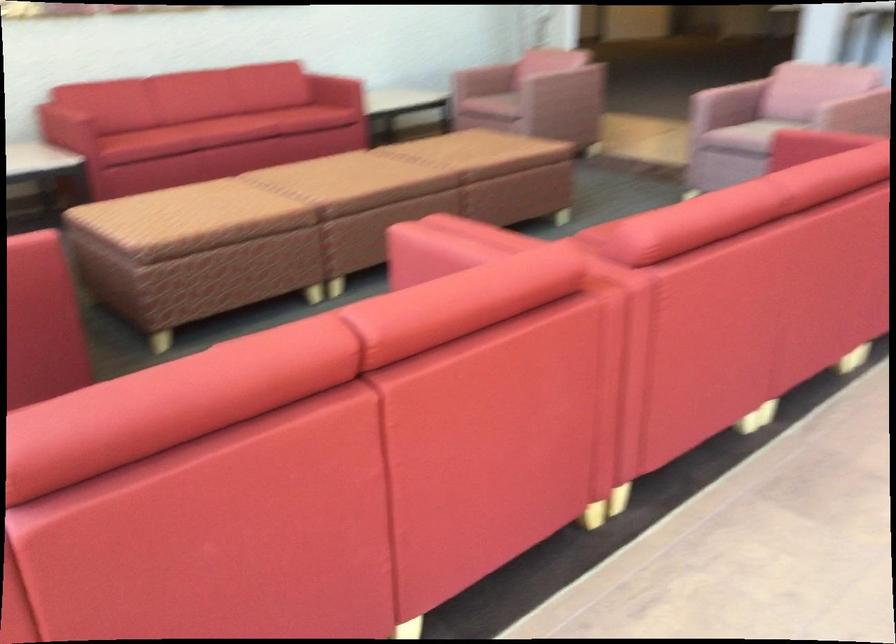
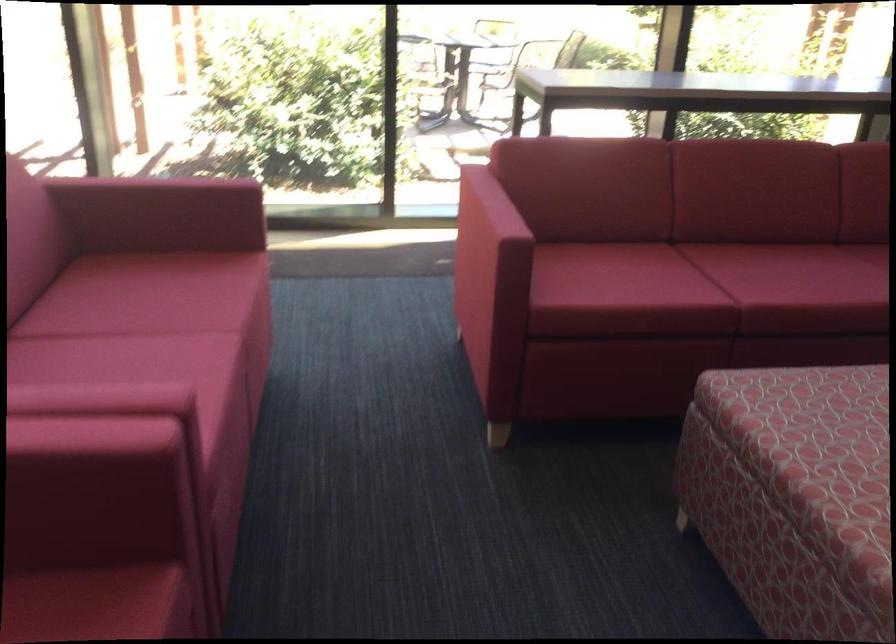
In the second image, find the point that corresponds to (x=222, y=218) in the first image.

(815, 460)